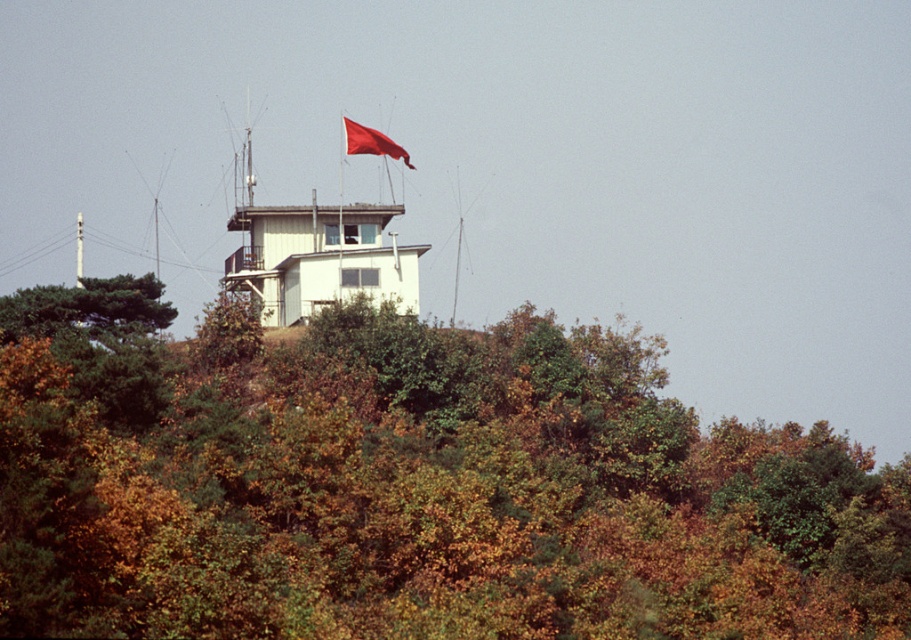
You are a hiker standing at the base of the hill looking up at the watchtower. You notice a green matte tree at upper center and a red fabric flag at upper center. Which object is located to the right of the other?

The green matte tree at upper center is positioned on the right side of the red fabric flag at upper center.

In the scene shown: You are standing at the base of the hill looking up at the watchtower. Which object, the green matte tree at upper center or the red fabric flag at upper center, would appear larger to you?

The green matte tree at upper center is closer to the viewer than the red fabric flag at upper center, so it would appear larger.